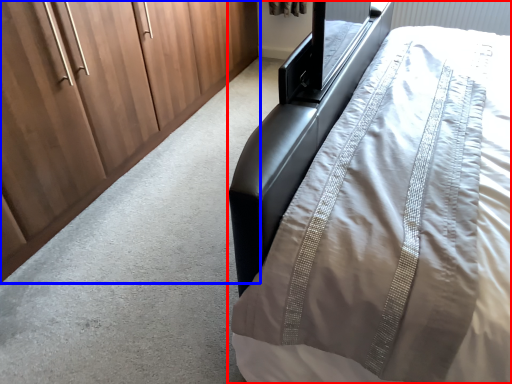
Question: Which of the following is the closest to the observer, bed (highlighted by a red box) or cupboard (highlighted by a blue box)?

Choices:
 (A) bed
 (B) cupboard

Answer: (A)